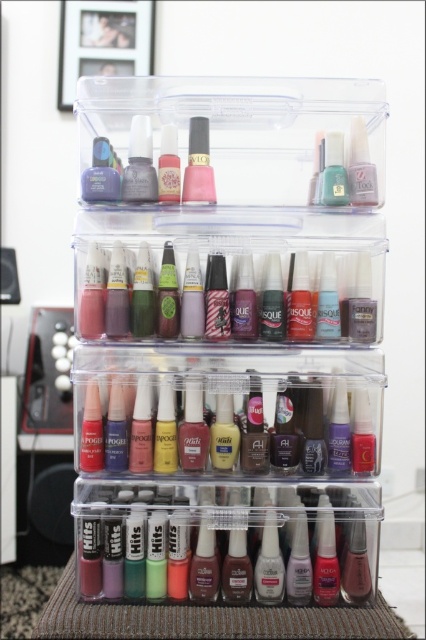
Between matte plastic lipstick at lower center and matte plastic lipsticks at center, which one has less height?

With less height is matte plastic lipsticks at center.

Is point (373, 582) closer to camera compared to point (86, 280)?

No.

Which is in front, point (187, 560) or point (169, 323)?

Point (169, 323)

The width and height of the screenshot is (426, 640). What are the coordinates of `matte plastic lipstick at lower center` in the screenshot? It's located at (227, 545).

Who is positioned more to the left, matte plastic lipstick at center or matte pink nail polish at center?

Positioned to the left is matte pink nail polish at center.

How distant is matte plastic lipstick at center from matte pink nail polish at center?

matte plastic lipstick at center is 32.03 centimeters from matte pink nail polish at center.

Which is behind, point (108, 406) or point (201, 134)?

The point (108, 406) is more distant.

The image size is (426, 640). I want to click on matte plastic lipstick at center, so click(227, 422).

Which is behind, point (363, 320) or point (370, 170)?

The point (363, 320) is more distant.

Measure the distance from matte plastic lipsticks at center to satin pink nail polish at center.

The distance of matte plastic lipsticks at center from satin pink nail polish at center is 8.35 inches.

Does point (247, 276) lie behind point (362, 170)?

Yes.

Where is `matte plastic lipsticks at center`? The width and height of the screenshot is (426, 640). matte plastic lipsticks at center is located at coordinates (227, 291).